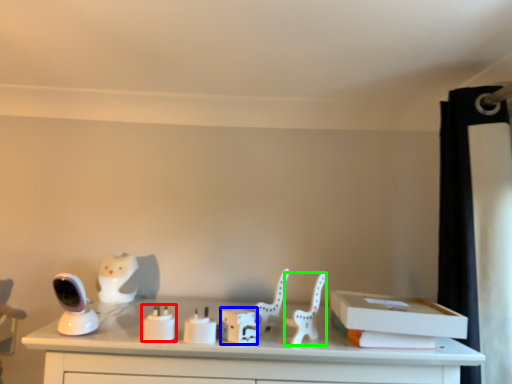
Question: Which is nearer to the candle holder (highlighted by a red box)? box (highlighted by a blue box) or chair (highlighted by a green box).

Choices:
 (A) box
 (B) chair

Answer: (A)